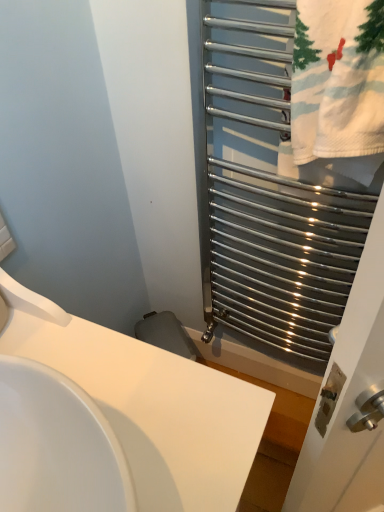
Locate an element on the screen. This screenshot has width=384, height=512. polished metal towel rack at right is located at coordinates (271, 192).

Measure the distance between polished metal towel rack at right and camera.

26.31 inches.

What do you see at coordinates (336, 94) in the screenshot?
I see `white cotton towel at right` at bounding box center [336, 94].

Identify the location of white cotton towel at right. This screenshot has height=512, width=384. (336, 94).

The image size is (384, 512). What do you see at coordinates (149, 404) in the screenshot? I see `white glossy sink at center` at bounding box center [149, 404].

The width and height of the screenshot is (384, 512). I want to click on polished metal towel rack at right, so (x=271, y=192).

Looking at this image, from a real-world perspective, between white cotton towel at right and polished metal towel rack at right, who is vertically higher?

In real-world perspective, white cotton towel at right is above.

At what (x,y) coordinates should I click in order to perform the action: click on bath towel that appears behind the polished metal towel rack at right. Please return your answer as a coordinate pair (x, y). This screenshot has width=384, height=512. Looking at the image, I should click on (336, 94).

From the image's perspective, which one is positioned higher, white cotton towel at right or polished metal towel rack at right?

white cotton towel at right is shown above in the image.

Which object is wider, white glossy sink at center or white cotton towel at right?

white glossy sink at center.

Which of these two, white glossy sink at center or white cotton towel at right, is bigger?

white glossy sink at center.

How many degrees apart are the facing directions of white glossy sink at center and white cotton towel at right?

white glossy sink at center and white cotton towel at right are facing 89.8 degrees away from each other.

Considering the relative sizes of white cotton towel at right and white glossy sink at center in the image provided, is white cotton towel at right thinner than white glossy sink at center?

Yes, white cotton towel at right is thinner than white glossy sink at center.

Between white cotton towel at right and white glossy sink at center, which one has larger size?

white glossy sink at center is bigger.

From the image's perspective, is white cotton towel at right over white glossy sink at center?

Indeed, from the image's perspective, white cotton towel at right is shown above white glossy sink at center.

Is white cotton towel at right facing towards white glossy sink at center?

Yes.

From a real-world perspective, is polished metal towel rack at right positioned over white cotton towel at right based on gravity?

No, from a real-world perspective, polished metal towel rack at right is not over white cotton towel at right

Are polished metal towel rack at right and white cotton towel at right far apart?

That's not correct — polished metal towel rack at right is a little close to white cotton towel at right.

Looking at their sizes, would you say polished metal towel rack at right is wider or thinner than white cotton towel at right?

Clearly, polished metal towel rack at right has more width compared to white cotton towel at right.

Which of these two, polished metal towel rack at right or white cotton towel at right, is bigger?

polished metal towel rack at right is bigger.

Does white glossy sink at center come in front of polished metal towel rack at right?

Yes, white glossy sink at center is closer to the camera.

Is point (255, 437) less distant than point (212, 38)?

Yes, point (255, 437) is in front of point (212, 38).

Does white glossy sink at center contain polished metal towel rack at right?

No, white glossy sink at center does not contain polished metal towel rack at right.

Looking at this image, from a real-world perspective, which object stands above the other?

polished metal towel rack at right, from a real-world perspective.

Find the location of a particular element. This screenshot has width=384, height=512. cage above the white glossy sink at center (from a real-world perspective) is located at coordinates (271, 192).

In the image, is polished metal towel rack at right on the left side or the right side of white glossy sink at center?

In the image, polished metal towel rack at right appears on the right side of white glossy sink at center.

Based on their sizes in the image, would you say polished metal towel rack at right is bigger or smaller than white glossy sink at center?

polished metal towel rack at right is smaller than white glossy sink at center.

In terms of width, does polished metal towel rack at right look wider or thinner when compared to white glossy sink at center?

Considering their sizes, polished metal towel rack at right looks slimmer than white glossy sink at center.

This screenshot has width=384, height=512. In the image, there is a white cotton towel at right. In order to click on cage below it (from a real-world perspective) in this screenshot , I will do `click(271, 192)`.

Where is `sink in front of the white cotton towel at right`? sink in front of the white cotton towel at right is located at coordinates (149, 404).

When comparing their distances from white cotton towel at right, does white glossy sink at center or polished metal towel rack at right seem further?

Based on the image, white glossy sink at center appears to be further to white cotton towel at right.

Estimate the real-world distances between objects in this image. Which object is closer to polished metal towel rack at right, white cotton towel at right or white glossy sink at center?

white cotton towel at right lies closer to polished metal towel rack at right than the other object.

Based on the photo, estimate the real-world distances between objects in this image. Which object is further from white glossy sink at center, white cotton towel at right or polished metal towel rack at right?

Based on the image, polished metal towel rack at right appears to be further to white glossy sink at center.

Estimate the real-world distances between objects in this image. Which object is closer to polished metal towel rack at right, white glossy sink at center or white cotton towel at right?

white cotton towel at right.

Based on their spatial positions, is polished metal towel rack at right or white glossy sink at center closer to white cotton towel at right?

Based on the image, polished metal towel rack at right appears to be nearer to white cotton towel at right.

Considering their positions, is polished metal towel rack at right positioned further to white glossy sink at center than white cotton towel at right?

polished metal towel rack at right.

This screenshot has width=384, height=512. I want to click on cage between white cotton towel at right and white glossy sink at center from top to bottom, so click(x=271, y=192).